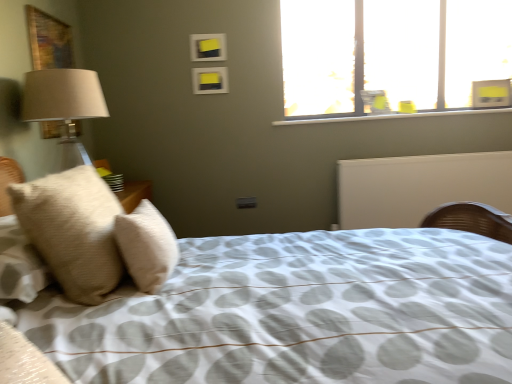
Question: Is yellow matte picture frame at upper center, which is the 2th picture frame in top-to-bottom order, in front of or behind transparent glass window at upper right in the image?

Choices:
 (A) behind
 (B) front

Answer: (B)

Question: From a real-world perspective, is yellow matte picture frame at upper center, which is the 2th picture frame in top-to-bottom order, positioned above or below transparent glass window at upper right?

Choices:
 (A) above
 (B) below

Answer: (B)

Question: Which is farther from the yellow matte picture frame at upper center, which is counted as the 1th picture frame, starting from the bottom?

Choices:
 (A) matte black picture frame at upper center, marked as the first picture frame in a top-to-bottom arrangement
 (B) transparent glass window at upper right
 (C) white textured bed at center
 (D) beige textured pillow at left, the 2th pillow positioned from the right
 (E) white matte radiator at center

Answer: (C)

Question: Estimate the real-world distances between objects in this image. Which object is closer to the white matte radiator at center?

Choices:
 (A) beige soft pillow at left, arranged as the 1th pillow when viewed from the right
 (B) white textured bed at center
 (C) transparent glass window at upper right
 (D) yellow matte picture frame at upper center, which is counted as the 1th picture frame, starting from the bottom
 (E) beige textured pillow at left, the 2th pillow positioned from the right

Answer: (C)